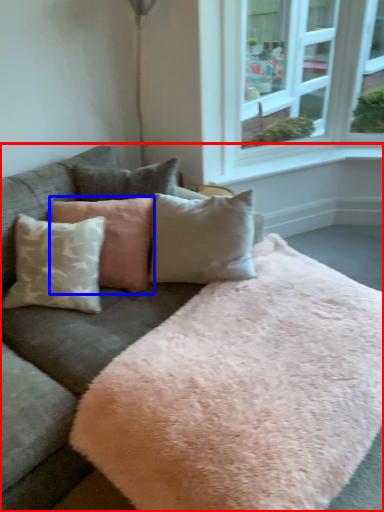
Question: Among these objects, which one is nearest to the camera, studio couch (highlighted by a red box) or pillow (highlighted by a blue box)?

Choices:
 (A) studio couch
 (B) pillow

Answer: (A)